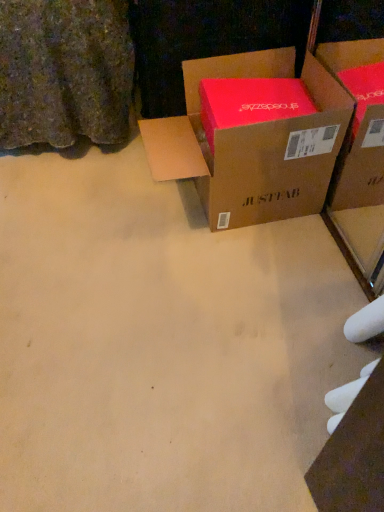
What are the coordinates of `vacant space in front of matte cardboard box at center` in the screenshot? It's located at (236, 297).